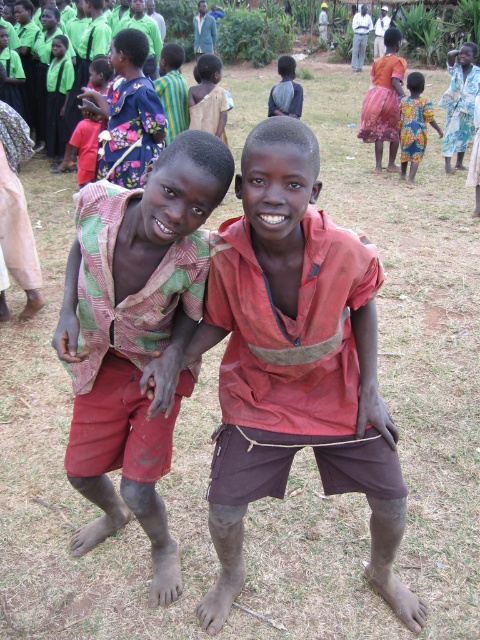
Question: Is multicolored fabric vest at center behind vibrant floral dress at upper right?

Choices:
 (A) no
 (B) yes

Answer: (A)

Question: Among these points, which one is nearest to the camera?

Choices:
 (A) (425, 108)
 (B) (300, 102)

Answer: (A)

Question: Which is nearer to the multicolored fabric vest at center?

Choices:
 (A) matte black shirt at upper center
 (B) red matte shirt at center
 (C) vibrant floral dress at upper right

Answer: (B)

Question: Which object is positioned closest to the matte black shirt at upper center?

Choices:
 (A) red matte shirt at center
 (B) multicolored fabric vest at center
 (C) vibrant floral dress at upper right

Answer: (C)

Question: Can you confirm if multicolored fabric vest at center is thinner than vibrant floral dress at upper right?

Choices:
 (A) no
 (B) yes

Answer: (A)

Question: Where is red matte shirt at center located in relation to vibrant floral dress at upper right in the image?

Choices:
 (A) left
 (B) right

Answer: (A)